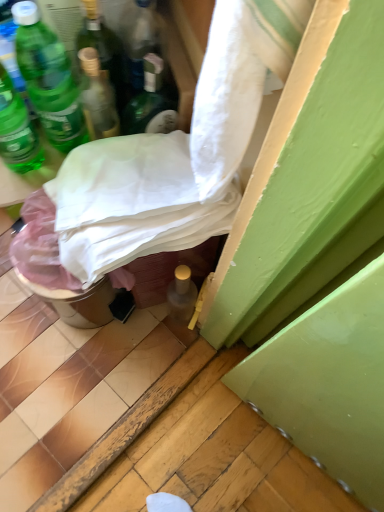
Question: Considering the positions of green matte bottle at upper left, the 3th bottle from the left, and green glass bottle at upper left, the 1th bottle from the left, in the image, is green matte bottle at upper left, the 3th bottle from the left, wider or thinner than green glass bottle at upper left, the 1th bottle from the left,?

Choices:
 (A) wide
 (B) thin

Answer: (A)

Question: Considering the positions of green matte bottle at upper left, arranged as the 3th bottle when viewed from the right, and green glass bottle at upper left, the 5th bottle viewed from the right, in the image, is green matte bottle at upper left, arranged as the 3th bottle when viewed from the right, bigger or smaller than green glass bottle at upper left, the 5th bottle viewed from the right,?

Choices:
 (A) big
 (B) small

Answer: (B)

Question: Which is nearer to the green matte bottle at upper left, which is the 4th bottle from right to left?

Choices:
 (A) translucent glass bottle at upper center, marked as the fifth bottle in a left-to-right arrangement
 (B) green matte bottle at upper left, arranged as the 3th bottle when viewed from the right
 (C) green glass bottle at upper left, which is counted as the fourth bottle, starting from the left
 (D) white fabric at center
 (E) green glass bottle at upper left, the 5th bottle viewed from the right

Answer: (B)

Question: Estimate the real-world distances between objects in this image. Which object is closer to the white fabric at center?

Choices:
 (A) metallic silver bucket at lower left
 (B) green matte bottle at upper left, the 2th bottle positioned from the left
 (C) green glass bottle at upper left, which is counted as the fourth bottle, starting from the left
 (D) green matte bottle at upper left, the 3th bottle from the left
 (E) translucent glass bottle at upper center, marked as the fifth bottle in a left-to-right arrangement

Answer: (A)